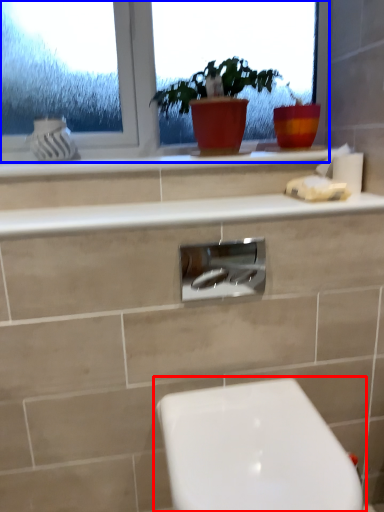
Question: Which object is further to the camera taking this photo, toilet (highlighted by a red box) or window (highlighted by a blue box)?

Choices:
 (A) toilet
 (B) window

Answer: (B)